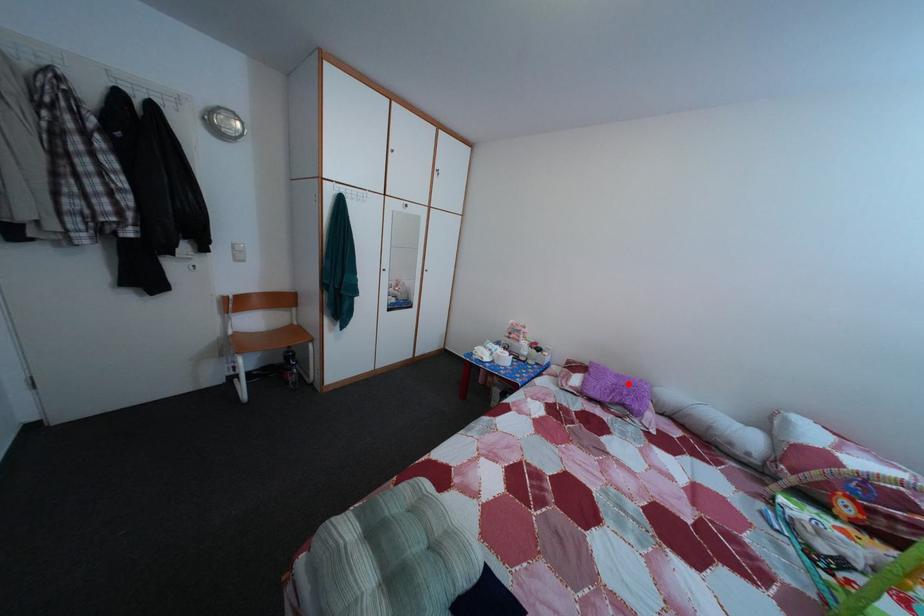
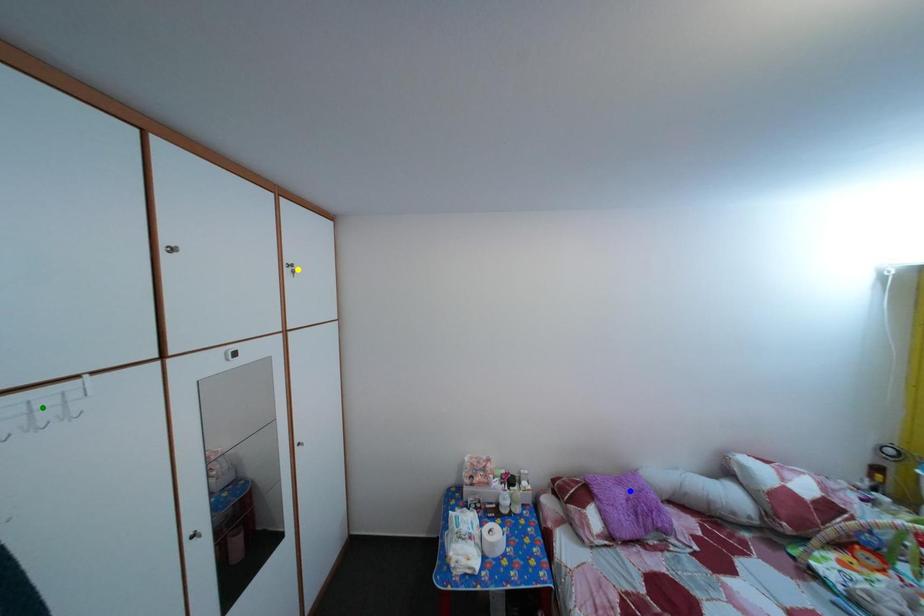
Question: I am providing you with two images of the same scene from different viewpoints. A red point is marked on the first image. You are given multiple points on the second image. Which spot in image 2 lines up with the point in image 1?

Choices:
 (A) yellow point
 (B) green point
 (C) blue point

Answer: (C)